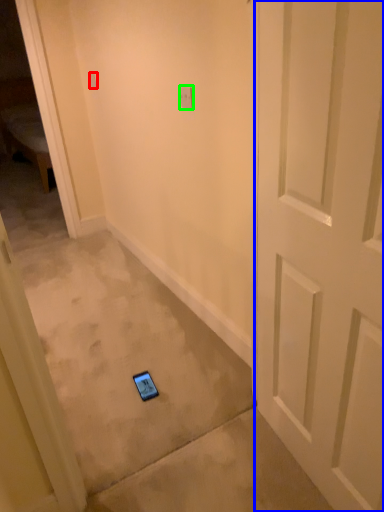
Question: Which is farther away from light switch (highlighted by a red box)? door (highlighted by a blue box) or light switch (highlighted by a green box)?

Choices:
 (A) door
 (B) light switch

Answer: (A)